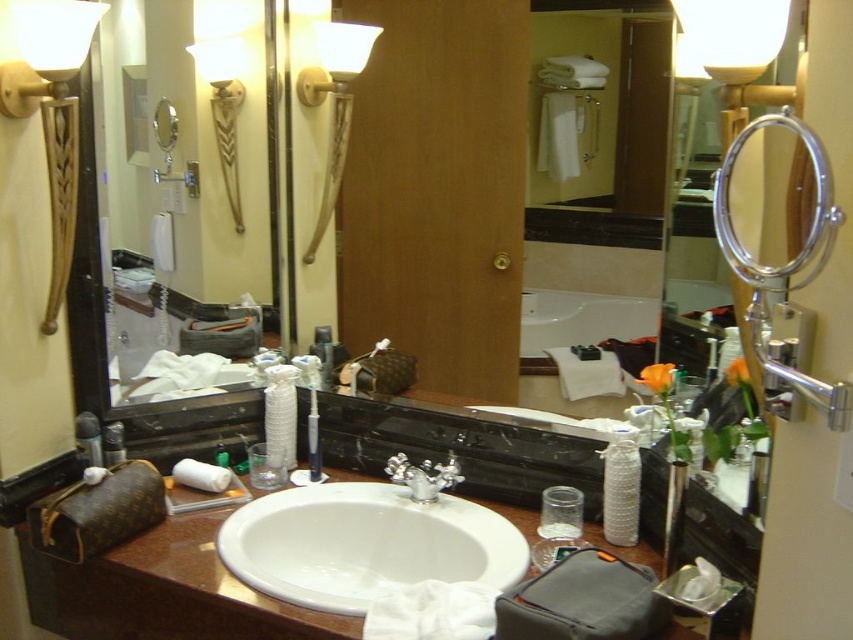
Question: Does matte gold sconce at upper left appear over gold textured lamp at upper left?

Choices:
 (A) no
 (B) yes

Answer: (A)

Question: Considering the real-world distances, which object is farthest from the matte black mirror at center?

Choices:
 (A) matte gold sconce at upper left
 (B) matte gold lamp at upper left
 (C) gold textured lamp at upper left

Answer: (A)

Question: Is gold textured lamp at upper left bigger than matte plastic toothbrush at left?

Choices:
 (A) no
 (B) yes

Answer: (B)

Question: Which object is positioned closest to the silver metallic faucet at center?

Choices:
 (A) metallic silver canister at left
 (B) matte plastic toothbrush at left
 (C) matte black mirror at center
 (D) matte black mirror at left

Answer: (B)

Question: Estimate the real-world distances between objects in this image. Which object is closer to the matte black mirror at left?

Choices:
 (A) translucent plastic toothbrush at center
 (B) matte black mirror at center
 (C) silver metallic faucet at center
 (D) metallic silver canister at left

Answer: (B)

Question: Can you confirm if matte gold lamp at upper left is positioned to the left of gold textured lamp at upper left?

Choices:
 (A) no
 (B) yes

Answer: (A)